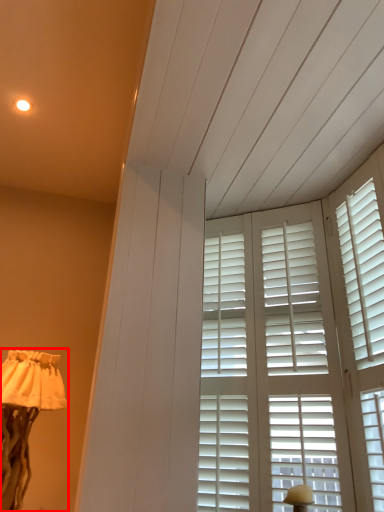
Question: From the image's perspective, what is the correct spatial positioning of lamp (annotated by the red box) in reference to window?

Choices:
 (A) below
 (B) above

Answer: (A)